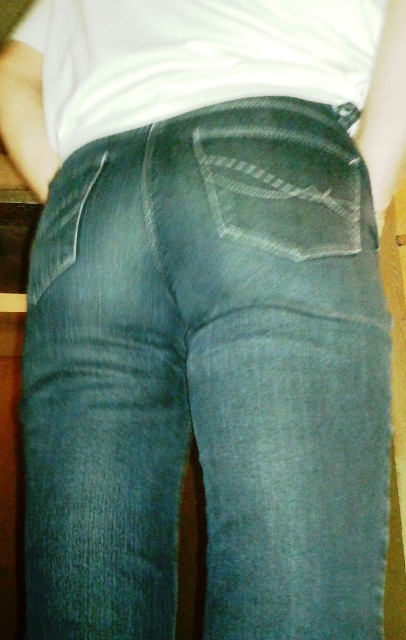
In the scene shown: You are standing in a room with a wooden floor and want to reach a point that is 24.64 inches away from you. The point is marked as point [215,80]. Can you estimate if this point is within your arm reach?

The point [215,80] is 24.64 inches away from the viewer. Since the average human arm length is about 25 to 27 inches, this point is within reach.

You are a photographer adjusting your camera settings. You want to focus on the white matte shirt at upper center while ensuring the background remains slightly blurred. Given the distance between the shirt and the camera, what should you set the focal length to achieve this effect?

To achieve a blurred background while focusing on the white matte shirt at upper center, set the focal length to a longer length, such as 85mm or higher, considering the distance of 23.68 inches between the shirt and the camera.